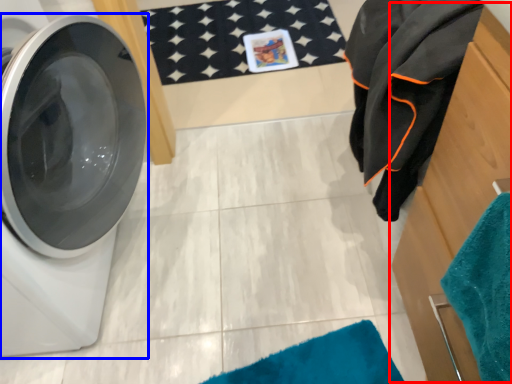
Question: Among these objects, which one is farthest to the camera, dresser (highlighted by a red box) or washing machine (highlighted by a blue box)?

Choices:
 (A) dresser
 (B) washing machine

Answer: (B)